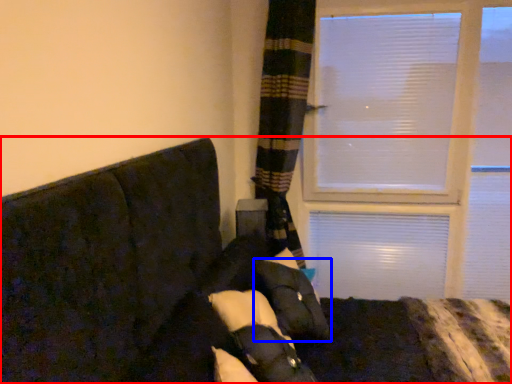
Question: Which object is further to the camera taking this photo, furniture (highlighted by a red box) or pillow (highlighted by a blue box)?

Choices:
 (A) furniture
 (B) pillow

Answer: (B)